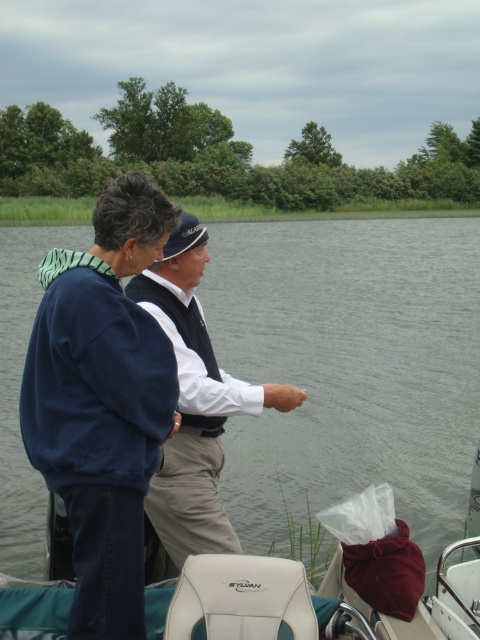
You are standing on the boat and want to place a small item at the point with coordinates point (103,401). Which object is this point located on?

The point (103,401) is located on the navy blue sweatshirt at center.

You are on a boat with two people. There is a point marked at coordinates (349, 365). What does this point represent?

The point at coordinates (349, 365) represents clear water at center.

You are on the boat and want to place a small item on the nearest point between point (320, 227) and point (210, 356). Which point should you choose?

Point (320, 227) is further to the viewer than point (210, 356), so the nearest point is point (210, 356).